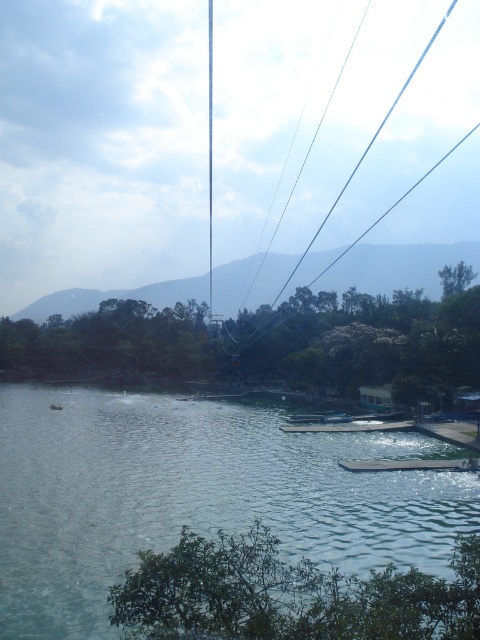
You are standing on the pier where the small boats are docked. There is a point marked at coordinates (195, 497) in the image. What is located at that point?

The point at (195, 497) corresponds to the greenish blue water at lower left.